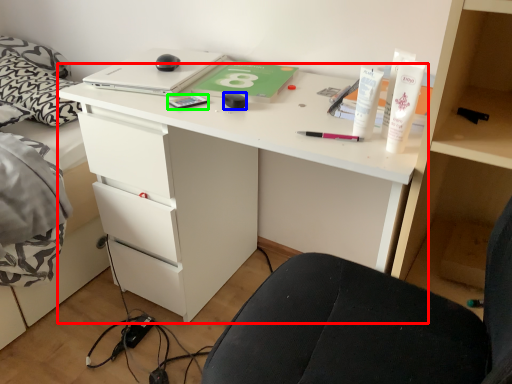
Question: Estimate the real-world distances between objects in this image. Which object is closer to desk (highlighted by a red box), stationery (highlighted by a blue box) or stationery (highlighted by a green box)?

Choices:
 (A) stationery
 (B) stationery

Answer: (B)